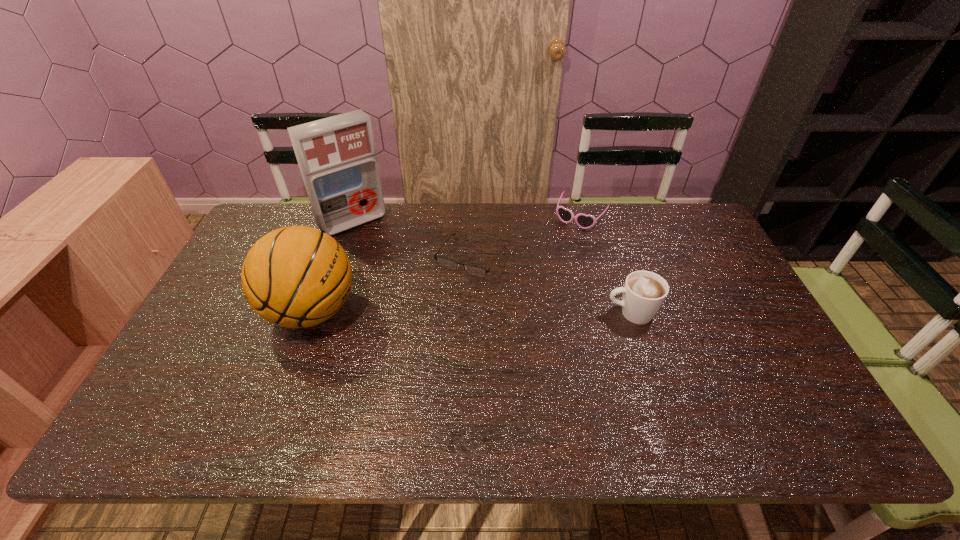
This screenshot has width=960, height=540. I want to click on vacant space located on the front-facing side of the first-aid kit, so click(x=378, y=249).

You are a GUI agent. You are given a task and a screenshot of the screen. Output one action in this format:
    pyautogui.click(x=<x>, y=<y>)
    Task: Click on the spectacles positioned at the far edge
    
    Given the screenshot: What is the action you would take?
    pyautogui.click(x=445, y=262)

Find the location of a particular element. Image resolution: width=960 pixels, height=540 pixels. sunglasses that is at the far edge is located at coordinates (584, 221).

Locate an element on the screen. The height and width of the screenshot is (540, 960). the first-aid kit at the far edge is located at coordinates (337, 158).

You are a GUI agent. You are given a task and a screenshot of the screen. Output one action in this format:
    pyautogui.click(x=<x>, y=<y>)
    Task: Click on the free space at the far edge of the desktop
    
    Given the screenshot: What is the action you would take?
    pyautogui.click(x=523, y=222)

In the image, there is a desktop. At what (x,y) coordinates should I click in order to perform the action: click on vacant region at the near edge. Please return your answer as a coordinate pair (x, y). The width and height of the screenshot is (960, 540). Looking at the image, I should click on (540, 376).

In the image, there is a desktop. Identify the location of blank space at the left edge. This screenshot has height=540, width=960. (189, 356).

The width and height of the screenshot is (960, 540). What are the coordinates of `vacant space at the right edge of the desktop` in the screenshot? It's located at [714, 291].

At what (x,y) coordinates should I click in order to perform the action: click on vacant space at the far left corner of the desktop. Please return your answer as a coordinate pair (x, y). This screenshot has height=540, width=960. Looking at the image, I should click on (299, 221).

You are a GUI agent. You are given a task and a screenshot of the screen. Output one action in this format:
    pyautogui.click(x=<x>, y=<y>)
    Task: Click on the vacant space at the near left corner
    The image size is (960, 540).
    Given the screenshot: What is the action you would take?
    pyautogui.click(x=207, y=380)